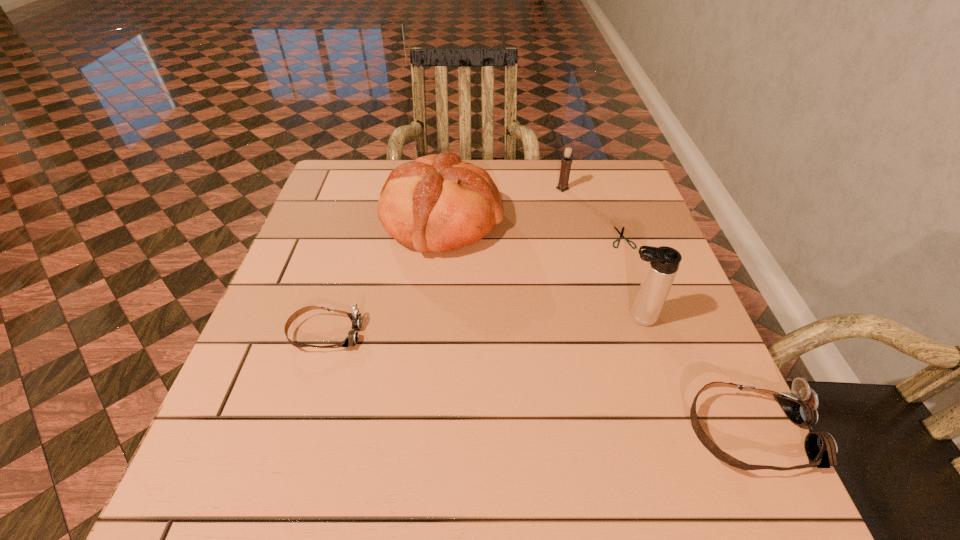
You are a GUI agent. You are given a task and a screenshot of the screen. Output one action in this format:
    pyautogui.click(x=<x>, y=<y>)
    Task: Click on the free space at the far right corner
    
    Given the screenshot: What is the action you would take?
    pyautogui.click(x=636, y=188)

Locate an element on the screen. The image size is (960, 540). vacant area that lies between the thermos bottle and the bread is located at coordinates (540, 269).

This screenshot has width=960, height=540. What are the coordinates of `free space between the thermos bottle and the taller goggles` in the screenshot? It's located at (693, 375).

You are a GUI agent. You are given a task and a screenshot of the screen. Output one action in this format:
    pyautogui.click(x=<x>, y=<y>)
    Task: Click on the vacant space that's between the candle holder and the left goggles
    The image size is (960, 540).
    Given the screenshot: What is the action you would take?
    pyautogui.click(x=444, y=261)

Where is `empty space that is in between the thermos bottle and the right goggles`? empty space that is in between the thermos bottle and the right goggles is located at coordinates (693, 375).

Find the location of a particular element. free spot between the bread and the thermos bottle is located at coordinates (540, 269).

You are a GUI agent. You are given a task and a screenshot of the screen. Output one action in this format:
    pyautogui.click(x=<x>, y=<y>)
    Task: Click on the vacant space that is in between the shortest object and the right goggles
    The height and width of the screenshot is (540, 960).
    Given the screenshot: What is the action you would take?
    pyautogui.click(x=685, y=335)

Locate an element on the screen. The image size is (960, 540). vacant area between the fourth shortest object and the shears is located at coordinates (592, 213).

The image size is (960, 540). What are the coordinates of `free point between the thermos bottle and the fifth tallest object` in the screenshot? It's located at (481, 326).

You are a GUI agent. You are given a task and a screenshot of the screen. Output one action in this format:
    pyautogui.click(x=<x>, y=<y>)
    Task: Click on the free space between the thermos bottle and the third object from left to right
    This screenshot has width=960, height=540.
    Given the screenshot: What is the action you would take?
    pyautogui.click(x=600, y=253)